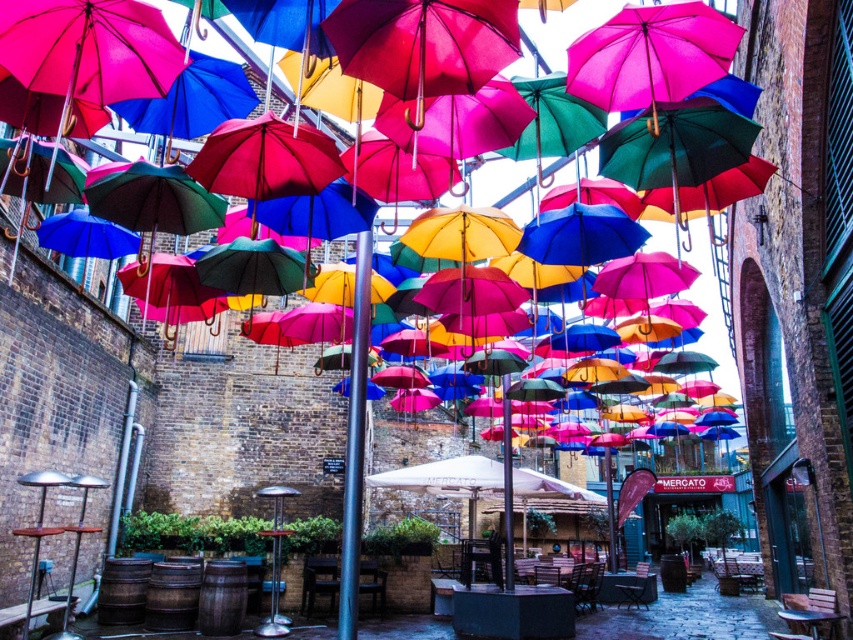
Does polished metal pole at center appear under white fabric umbrella at center?

No, polished metal pole at center is not below white fabric umbrella at center.

How far apart are polished metal pole at center and white fabric umbrella at center?

polished metal pole at center is 16.18 feet from white fabric umbrella at center.

What do you see at coordinates (355, 440) in the screenshot? The width and height of the screenshot is (853, 640). I see `polished metal pole at center` at bounding box center [355, 440].

This screenshot has width=853, height=640. Find the location of `polished metal pole at center`. polished metal pole at center is located at coordinates (355, 440).